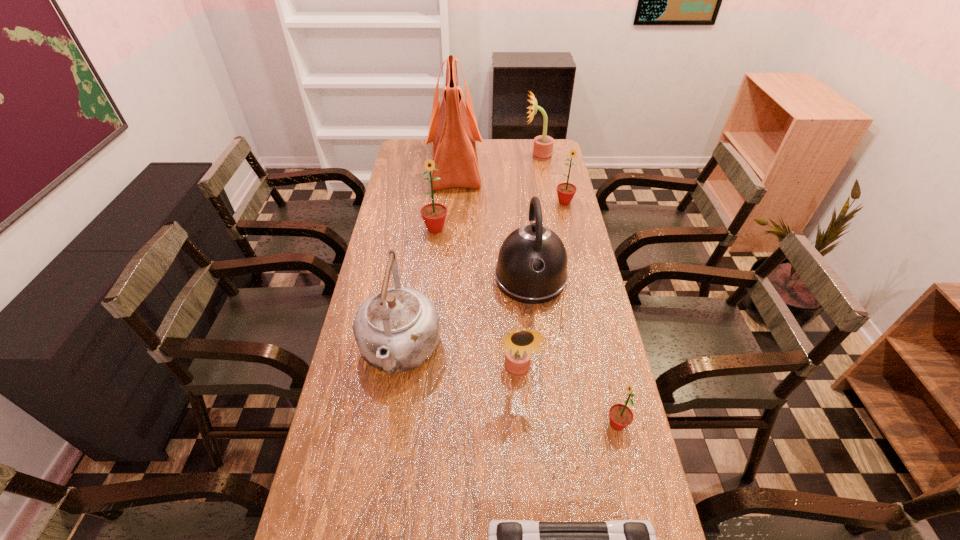
The width and height of the screenshot is (960, 540). I want to click on sunflower that is at the left edge, so click(x=434, y=214).

You are a GUI agent. You are given a task and a screenshot of the screen. Output one action in this format:
    pyautogui.click(x=<x>, y=<y>)
    Task: Click on the kettle present at the left edge
    
    Given the screenshot: What is the action you would take?
    pyautogui.click(x=397, y=329)

Where is `kettle present at the right edge`? kettle present at the right edge is located at coordinates (532, 263).

Where is `object present at the far left corner`? This screenshot has width=960, height=540. object present at the far left corner is located at coordinates (453, 131).

This screenshot has width=960, height=540. I want to click on object at the far right corner, so click(x=543, y=145).

In the image, there is a desktop. Find the location of `vacant space at the far edge`. vacant space at the far edge is located at coordinates (494, 159).

The width and height of the screenshot is (960, 540). I want to click on vacant space at the left edge of the desktop, so click(413, 256).

Where is `free space at the right edge`? This screenshot has height=540, width=960. free space at the right edge is located at coordinates (559, 213).

Find the location of a particular element. free space at the far left corner of the desktop is located at coordinates (419, 160).

The image size is (960, 540). Find the location of `vacant space at the far right corner of the desktop`. vacant space at the far right corner of the desktop is located at coordinates (560, 164).